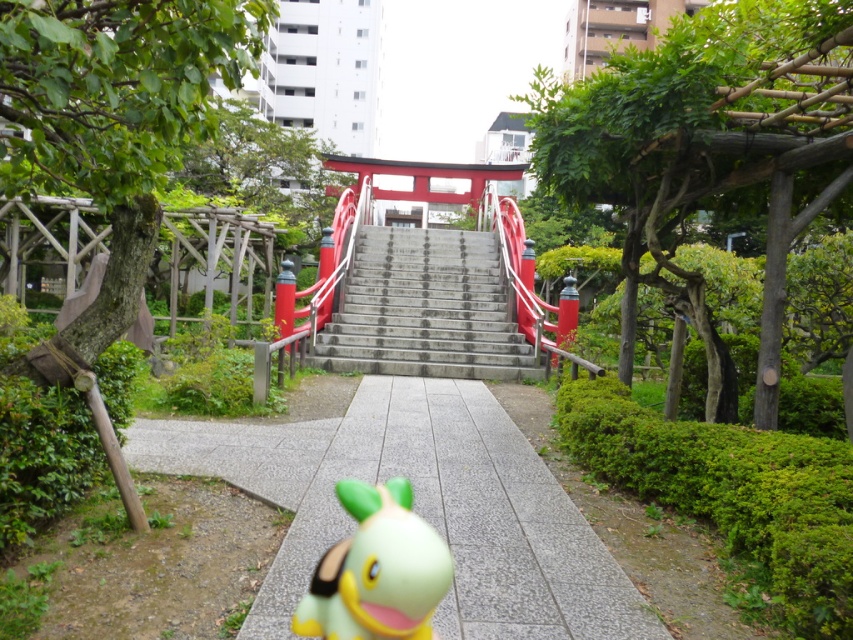
You are standing at the bottom of the stone steps leading to the torii gate and want to walk to the smooth concrete path at center. Which direction should you go relative to the torii gate?

The smooth concrete path at center is located at point (418, 506) in the image, so you should walk towards the center of the image relative to the torii gate at the top of the stone steps.

You are standing at the bottom of the smooth concrete stairs at center and want to pick up the green rubber toy at center. Which direction should you move to reach the toy?

The smooth concrete stairs at center is above the green rubber toy at center, so you should move downward to reach the green rubber toy at center.

You are a person walking towards the torii gate in the park. You see the smooth concrete path at center and the smooth concrete stairs at center. Which one is located below the other?

The smooth concrete path at center is positioned under the smooth concrete stairs at center, so the path is below the stairs.